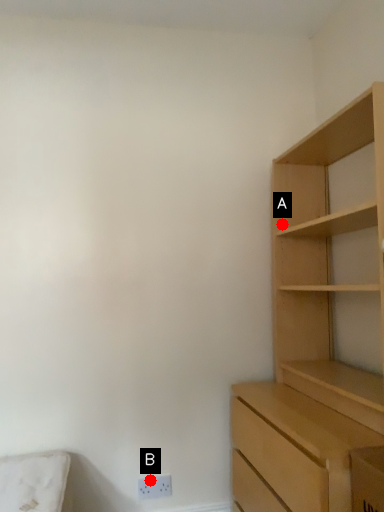
Question: Two points are circled on the image, labeled by A and B beside each circle. Which point appears farthest from the camera in this image?

Choices:
 (A) A is further
 (B) B is further

Answer: (A)